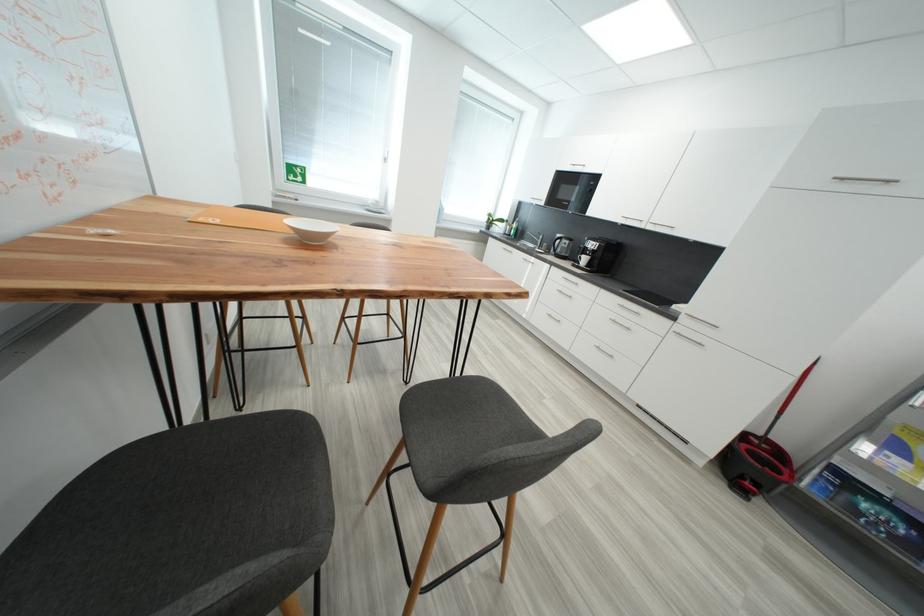
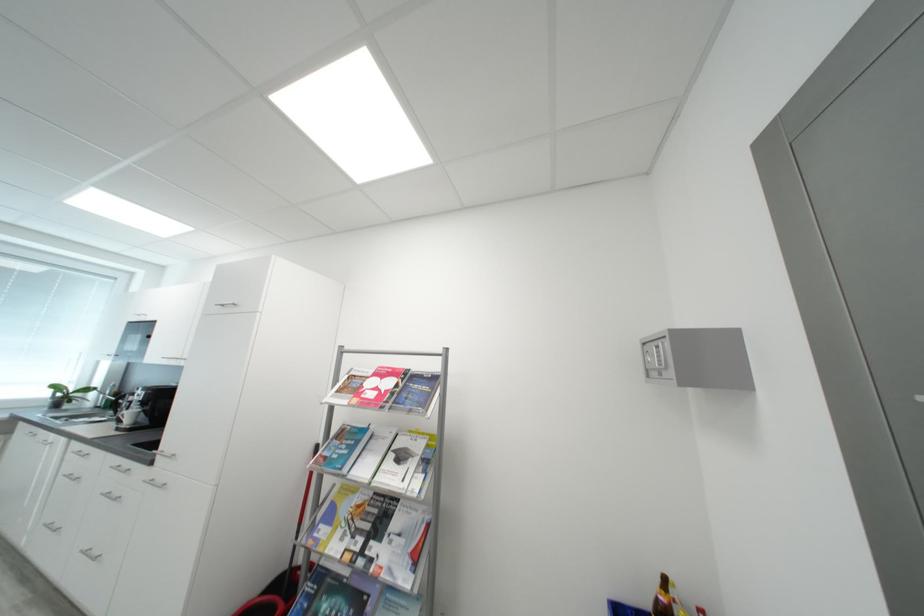
The point at (849, 180) is marked in the first image. Where is the corresponding point in the second image?

(228, 307)